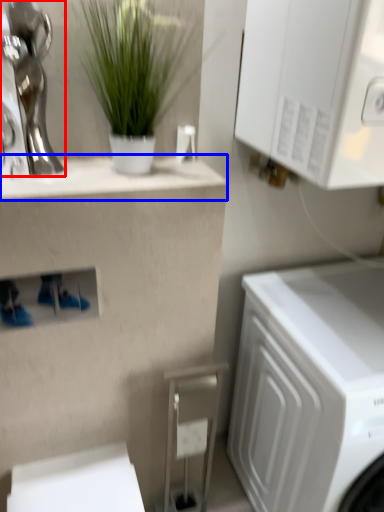
Question: Which object appears closest to the camera in this image, statue (highlighted by a red box) or counter top (highlighted by a blue box)?

Choices:
 (A) statue
 (B) counter top

Answer: (A)